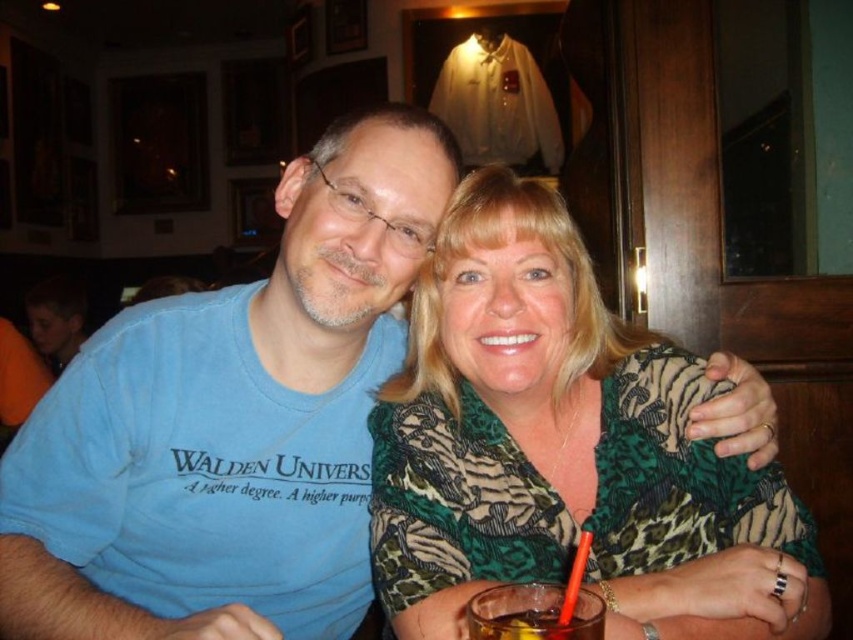
Between point (466, 529) and point (578, 552), which one is positioned behind?

The point (466, 529) is more distant.

Is point (755, 572) more distant than point (578, 557)?

Yes, it is behind point (578, 557).

Locate an element on the screen. green leopard print blouse at center is located at coordinates (566, 449).

At what (x,y) coordinates should I click in order to perform the action: click on green leopard print blouse at center. Please return your answer as a coordinate pair (x, y). The image size is (853, 640). Looking at the image, I should click on (566, 449).

Who is taller, dark amber liquid at lower center or orange plastic straw at lower center?

orange plastic straw at lower center

Is dark amber liquid at lower center below orange plastic straw at lower center?

Yes, dark amber liquid at lower center is below orange plastic straw at lower center.

The width and height of the screenshot is (853, 640). Find the location of `dark amber liquid at lower center`. dark amber liquid at lower center is located at coordinates (532, 624).

Can you confirm if green leopard print blouse at center is positioned to the left of dark amber liquid at lower center?

Answer: Incorrect, green leopard print blouse at center is not on the left side of dark amber liquid at lower center.

Which is behind, point (383, 397) or point (474, 634)?

The point (383, 397) is behind.

You are a GUI agent. You are given a task and a screenshot of the screen. Output one action in this format:
    pyautogui.click(x=<x>, y=<y>)
    Task: Click on the green leopard print blouse at center
    The height and width of the screenshot is (640, 853).
    Given the screenshot: What is the action you would take?
    pyautogui.click(x=566, y=449)